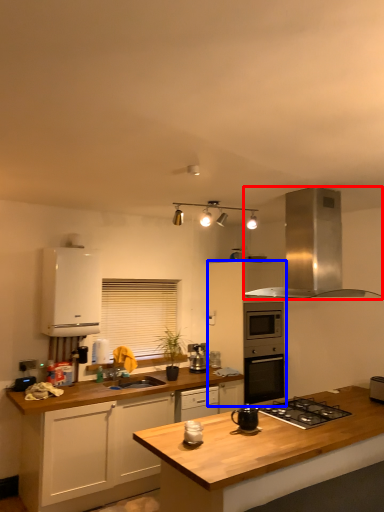
Question: Which object appears farthest to the camera in this image, home appliance (highlighted by a red box) or cabinetry (highlighted by a blue box)?

Choices:
 (A) home appliance
 (B) cabinetry

Answer: (B)